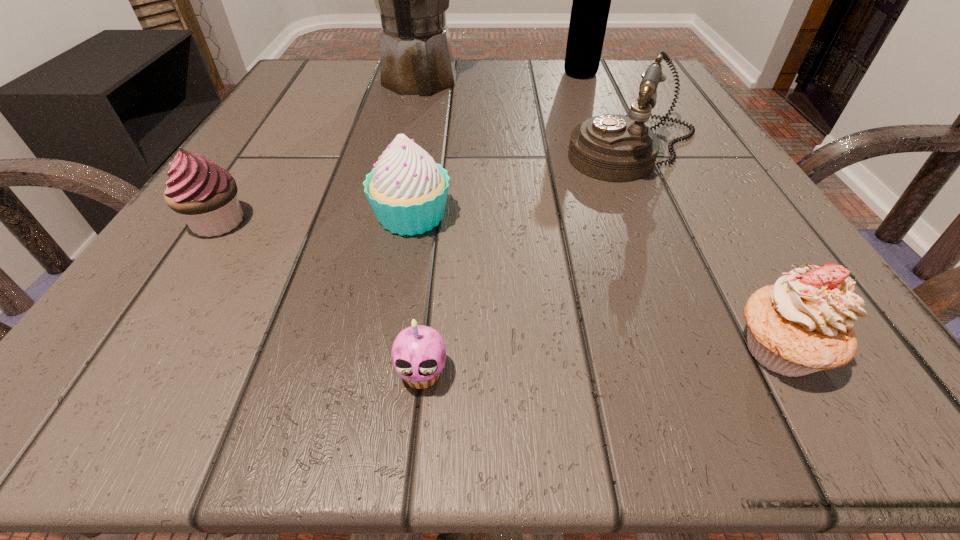
Identify the location of vacant space at the left edge of the desktop. (242, 168).

You are a GUI agent. You are given a task and a screenshot of the screen. Output one action in this format:
    pyautogui.click(x=<x>, y=<y>)
    Task: Click on the vacant region at the right edge
    
    Given the screenshot: What is the action you would take?
    pyautogui.click(x=683, y=280)

Identify the location of free space at the near left corner of the desktop. The width and height of the screenshot is (960, 540). (219, 403).

Locate an element on the screen. free space at the far right corner is located at coordinates (627, 88).

At what (x,y) coordinates should I click in order to perform the action: click on free space between the coffeepot and the telephone. Please return your answer as a coordinate pair (x, y). The image size is (960, 540). Looking at the image, I should click on (527, 117).

You are a GUI agent. You are given a task and a screenshot of the screen. Output one action in this format:
    pyautogui.click(x=<x>, y=<y>)
    Task: Click on the vacant region between the shortest cupcake and the beer bottle
    
    Given the screenshot: What is the action you would take?
    pyautogui.click(x=501, y=224)

Identify the location of free space between the rightmost cupcake and the shortest cupcake. The height and width of the screenshot is (540, 960). (600, 361).

Find the location of a particular element. The width and height of the screenshot is (960, 540). vacant point located between the beer bottle and the shortest cupcake is located at coordinates (501, 224).

The height and width of the screenshot is (540, 960). Identify the location of free space between the shortest cupcake and the leftmost object. (320, 298).

What are the coordinates of `blank region between the coffeepot and the rightmost cupcake` in the screenshot? It's located at (598, 216).